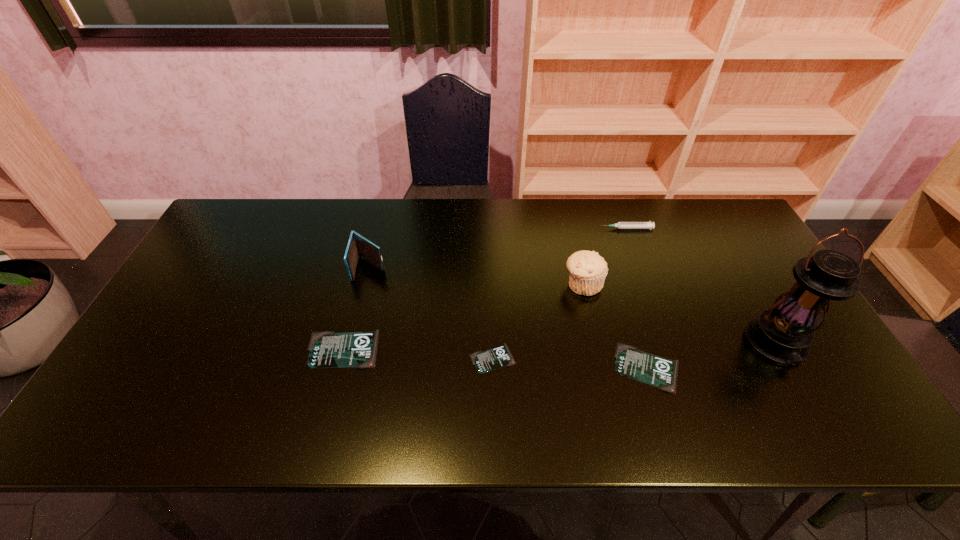
Observe the arrangement of all identity cards in the image. To keep them evenly spaced, where would you place another identity card on the right? Please locate a free space. Please provide its 2D coordinates. Your answer should be formatted as a tuple, i.e. [(x, y)], where the tuple contains the x and y coordinates of a point satisfying the conditions above.

[(807, 377)]